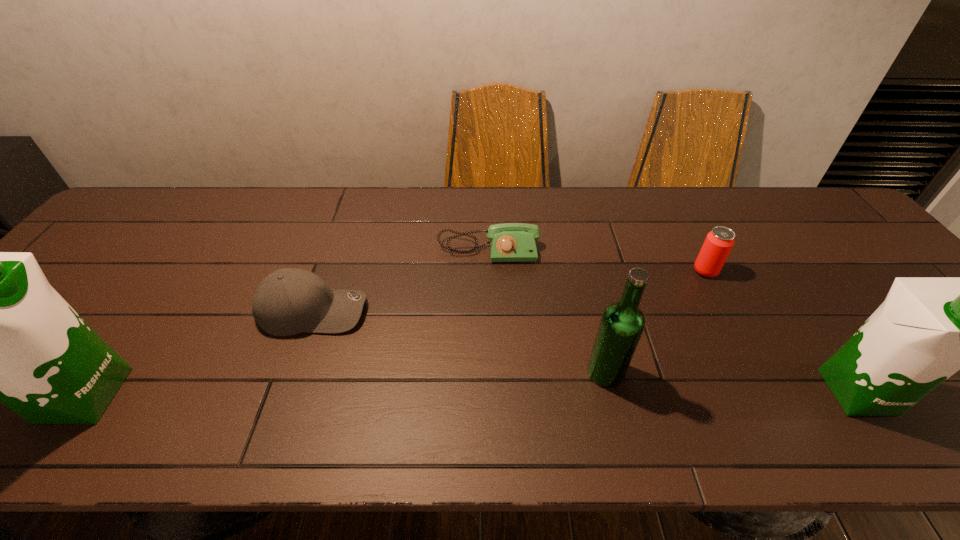
Locate an element on the screen. the leftmost object is located at coordinates (0, 332).

This screenshot has width=960, height=540. What are the coordinates of `the taller soya milk` in the screenshot? It's located at (0, 332).

Image resolution: width=960 pixels, height=540 pixels. What are the coordinates of `the right soya milk` in the screenshot? It's located at (927, 329).

You are a GUI agent. You are given a task and a screenshot of the screen. Output one action in this format:
    pyautogui.click(x=<x>, y=<y>)
    Task: Click on the rightmost object
    The width and height of the screenshot is (960, 540).
    Given the screenshot: What is the action you would take?
    pyautogui.click(x=927, y=329)

Identify the location of the shortest object. (509, 242).

Find the location of a particular element. This screenshot has width=960, height=540. telephone is located at coordinates (509, 242).

Where is `beer can`? Image resolution: width=960 pixels, height=540 pixels. beer can is located at coordinates (718, 243).

At what (x,y) coordinates should I click in order to perform the action: click on baseball cap. Please return your answer as a coordinate pair (x, y). Looking at the image, I should click on (289, 301).

The image size is (960, 540). Find the location of `the fourth nearest object`. the fourth nearest object is located at coordinates (289, 301).

The height and width of the screenshot is (540, 960). What are the coordinates of `beer bottle` in the screenshot? It's located at (622, 323).